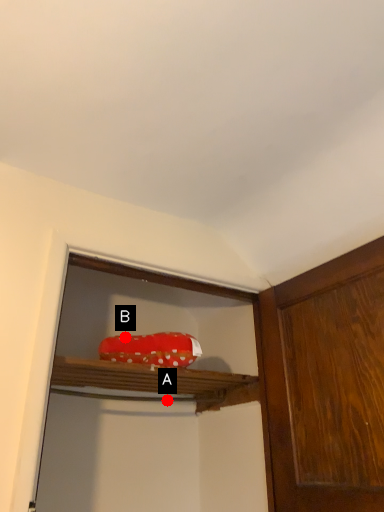
Question: Two points are circled on the image, labeled by A and B beside each circle. Which point is farther from the camera taking this photo?

Choices:
 (A) A is further
 (B) B is further

Answer: (A)